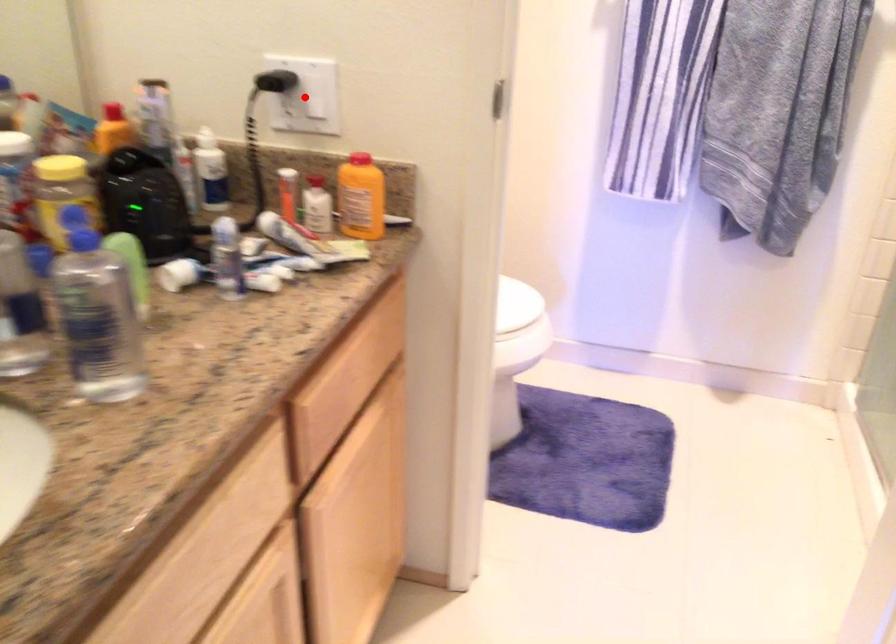
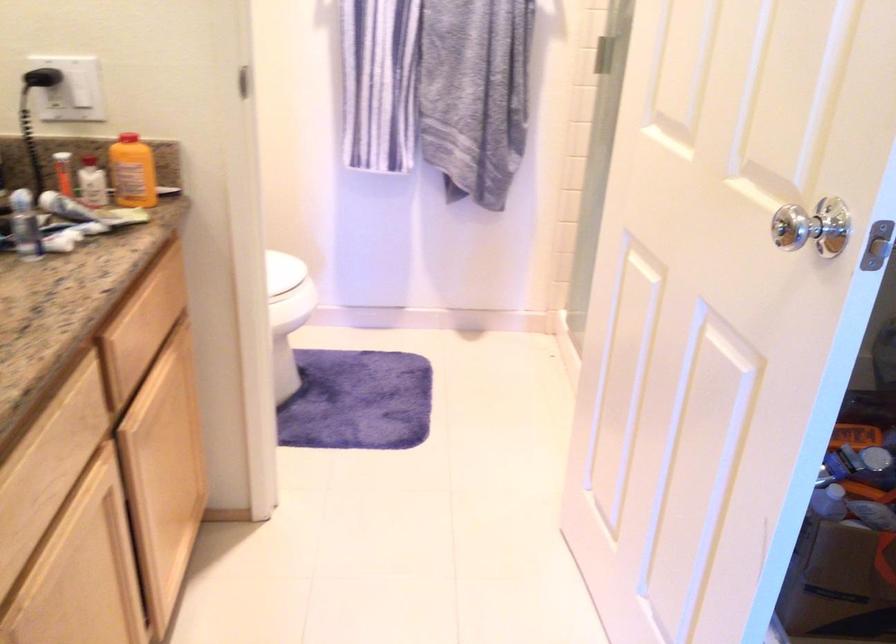
Question: I am providing you with two images of the same scene from different viewpoints. A red point is marked on the first image. Can you still see the location of the red point in image 2?

Choices:
 (A) Yes
 (B) No

Answer: (A)